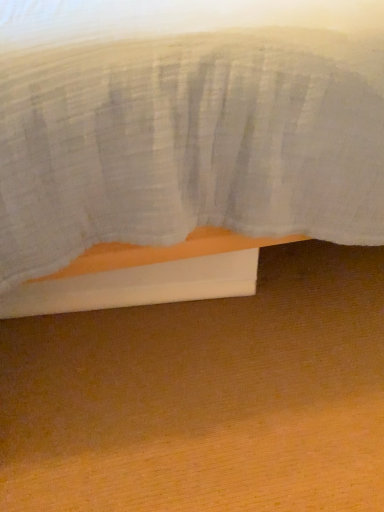
In order to face white sheer curtain at center, should I rotate leftwards or rightwards?

Turn right by 5.423 degrees to look at white sheer curtain at center.

Describe the element at coordinates (186, 123) in the screenshot. I see `white sheer curtain at center` at that location.

You are a GUI agent. You are given a task and a screenshot of the screen. Output one action in this format:
    pyautogui.click(x=<x>, y=<y>)
    Task: Click on the white sheer curtain at center
    
    Given the screenshot: What is the action you would take?
    pyautogui.click(x=186, y=123)

What is the approximate width of white sheer curtain at center?

It is 6.27 feet.

You are a GUI agent. You are given a task and a screenshot of the screen. Output one action in this format:
    pyautogui.click(x=<x>, y=<y>)
    Task: Click on the white sheer curtain at center
    
    Given the screenshot: What is the action you would take?
    pyautogui.click(x=186, y=123)